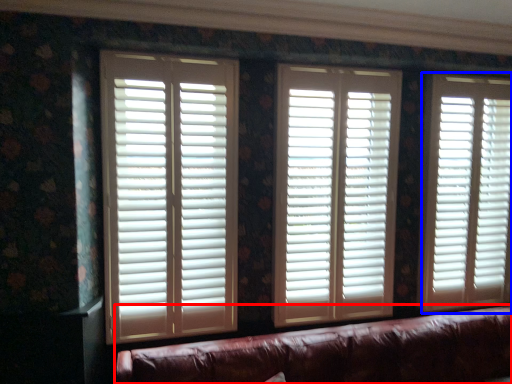
Question: Among these objects, which one is farthest to the camera, studio couch (highlighted by a red box) or window blind (highlighted by a blue box)?

Choices:
 (A) studio couch
 (B) window blind

Answer: (B)